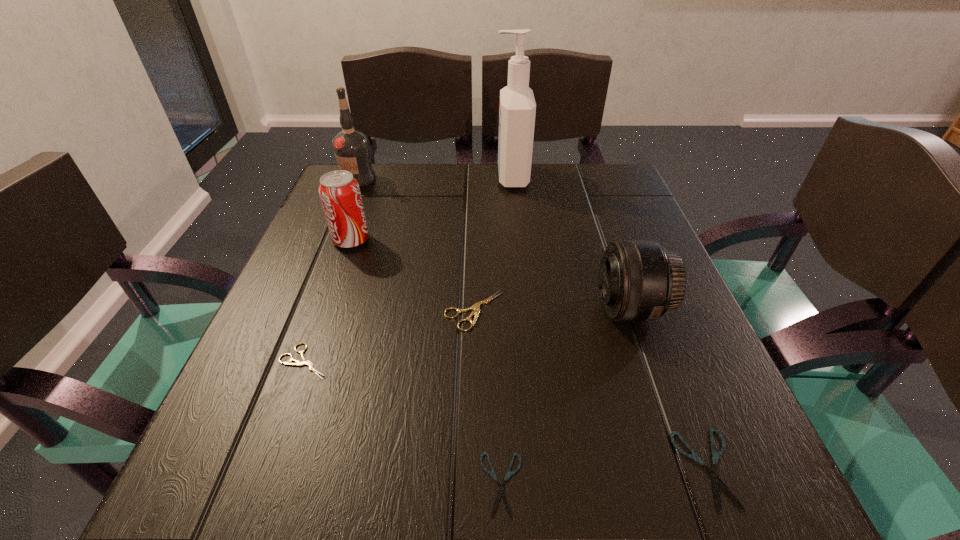
You are a GUI agent. You are given a task and a screenshot of the screen. Output one action in this format:
    pyautogui.click(x=<x>, y=<y>)
    Task: Click on the telephoto lens located in the right edge section of the desktop
    This screenshot has width=960, height=540.
    Given the screenshot: What is the action you would take?
    pyautogui.click(x=639, y=280)

Locate an element on the screen. The image size is (960, 540). shears located at the right edge is located at coordinates (716, 480).

The height and width of the screenshot is (540, 960). Find the location of `object that is at the far left corner`. object that is at the far left corner is located at coordinates (351, 147).

The height and width of the screenshot is (540, 960). In order to click on object at the near right corner in this screenshot , I will do `click(716, 480)`.

The height and width of the screenshot is (540, 960). In the image, there is a desktop. Find the location of `vacant region at the far edge`. vacant region at the far edge is located at coordinates (470, 167).

You are a GUI agent. You are given a task and a screenshot of the screen. Output one action in this format:
    pyautogui.click(x=<x>, y=<y>)
    Task: Click on the vacant point at the left edge
    
    Given the screenshot: What is the action you would take?
    pyautogui.click(x=269, y=318)

Where is `vacant space at the right edge`? vacant space at the right edge is located at coordinates (694, 342).

The height and width of the screenshot is (540, 960). In the image, there is a desktop. Identify the location of vacant space at the near left corner. (227, 518).

The image size is (960, 540). In the image, there is a desktop. In order to click on free region at the far right corner in this screenshot , I will do `click(583, 212)`.

Image resolution: width=960 pixels, height=540 pixels. Find the location of `free region at the near right corner`. free region at the near right corner is located at coordinates (664, 523).